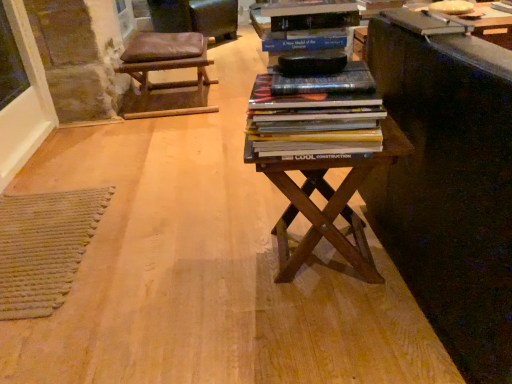
Question: Does hardcover books at center have a larger size compared to brown leather stool at upper left?

Choices:
 (A) yes
 (B) no

Answer: (B)

Question: From the image's perspective, is hardcover books at center below brown leather stool at upper left?

Choices:
 (A) no
 (B) yes

Answer: (B)

Question: Considering the relative sizes of hardcover books at center and brown leather stool at upper left in the image provided, is hardcover books at center shorter than brown leather stool at upper left?

Choices:
 (A) no
 (B) yes

Answer: (B)

Question: Considering the relative positions of hardcover books at center and brown leather stool at upper left in the image provided, is hardcover books at center to the left of brown leather stool at upper left from the viewer's perspective?

Choices:
 (A) yes
 (B) no

Answer: (B)

Question: Are hardcover books at center and brown leather stool at upper left far apart?

Choices:
 (A) no
 (B) yes

Answer: (B)

Question: Can you confirm if hardcover books at center is wider than brown leather stool at upper left?

Choices:
 (A) yes
 (B) no

Answer: (B)

Question: Is the depth of black matte bookshelf at upper center less than that of brown leather stool at upper left?

Choices:
 (A) no
 (B) yes

Answer: (B)

Question: Is black matte bookshelf at upper center aimed at brown leather stool at upper left?

Choices:
 (A) no
 (B) yes

Answer: (B)

Question: From a real-world perspective, does black matte bookshelf at upper center sit lower than brown leather stool at upper left?

Choices:
 (A) yes
 (B) no

Answer: (B)

Question: Considering the relative sizes of black matte bookshelf at upper center and brown leather stool at upper left in the image provided, is black matte bookshelf at upper center wider than brown leather stool at upper left?

Choices:
 (A) yes
 (B) no

Answer: (B)

Question: Is black matte bookshelf at upper center taller than brown leather stool at upper left?

Choices:
 (A) no
 (B) yes

Answer: (A)

Question: Does black matte bookshelf at upper center appear on the right side of brown leather stool at upper left?

Choices:
 (A) no
 (B) yes

Answer: (B)

Question: Is brown leather stool at upper left to the left of brown wooden table at center from the viewer's perspective?

Choices:
 (A) yes
 (B) no

Answer: (A)